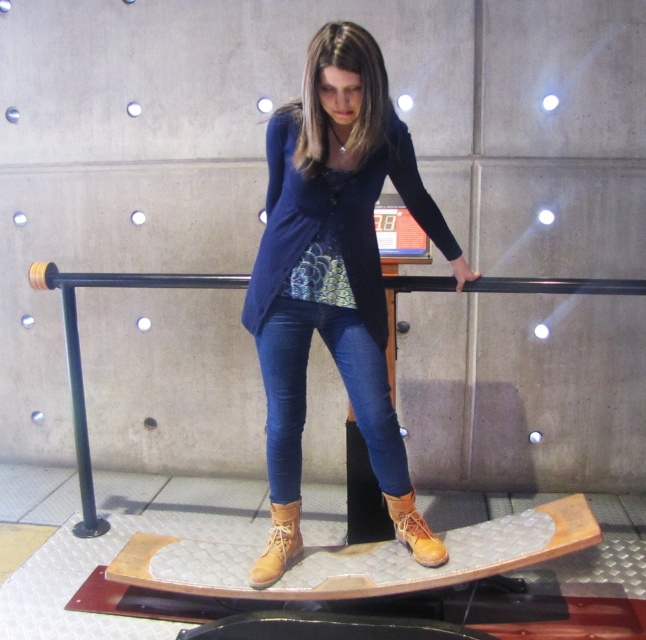
Based on the scene description, where is the matte blue jeans at center located in terms of coordinates?

The matte blue jeans at center is located at coordinates point (333, 250).

You are a physical therapist analyzing the position of two points on the balance board. Which point is closer to the viewer, point 1 at coordinates (289,515) or point 2 at (444,548)?

Point 1 at coordinates (289,515) is closer to the viewer than point 2 at (444,548).